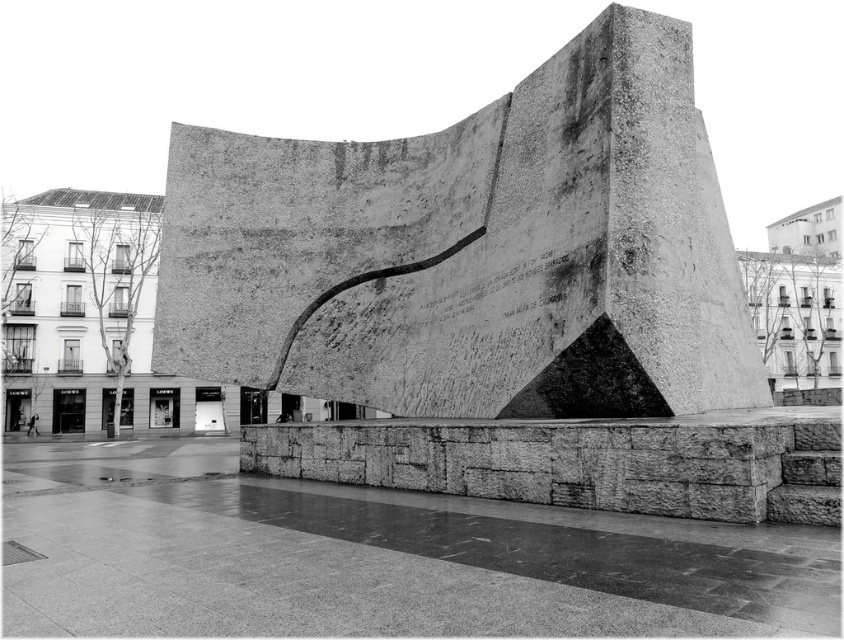
In the scene shown: Who is taller, smooth concrete wall at lower center or rough stone ledge at center?

Standing taller between the two is rough stone ledge at center.

You are a GUI agent. You are given a task and a screenshot of the screen. Output one action in this format:
    pyautogui.click(x=<x>, y=<y>)
    Task: Click on the smooth concrete wall at lower center
    This screenshot has width=844, height=640.
    Given the screenshot: What is the action you would take?
    pyautogui.click(x=398, y=568)

Where is `smooth concrete wall at lower center`? This screenshot has width=844, height=640. smooth concrete wall at lower center is located at coordinates (398, 568).

Looking at this image, who is higher up, rough concrete sculpture at center or smooth concrete wall at lower center?

Positioned higher is rough concrete sculpture at center.

Does rough concrete sculpture at center appear on the right side of smooth concrete wall at lower center?

Indeed, rough concrete sculpture at center is positioned on the right side of smooth concrete wall at lower center.

Is point (672, 221) positioned in front of point (828, 576)?

That is False.

At what (x,y) coordinates should I click in order to perform the action: click on rough concrete sculpture at center. Please return your answer as a coordinate pair (x, y). This screenshot has height=640, width=844. Looking at the image, I should click on tap(473, 252).

Which is below, rough concrete sculpture at center or rough stone ledge at center?

rough stone ledge at center

Can you confirm if rough concrete sculpture at center is bigger than rough stone ledge at center?

Yes.

The width and height of the screenshot is (844, 640). What do you see at coordinates (473, 252) in the screenshot?
I see `rough concrete sculpture at center` at bounding box center [473, 252].

Identify the location of rough concrete sculpture at center. (473, 252).